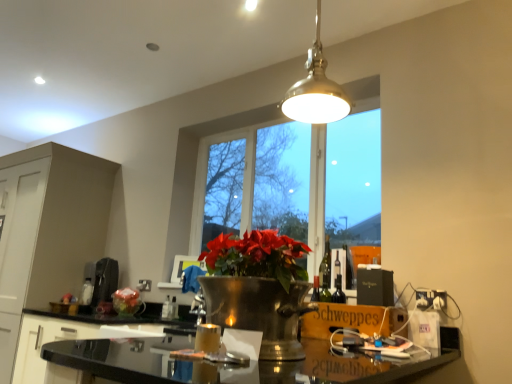
Question: From a real-world perspective, is clear glass window at center located higher than translucent glass bottle at center, which ranks as the 1th bottle in left-to-right order?

Choices:
 (A) no
 (B) yes

Answer: (B)

Question: Is clear glass window at center positioned behind translucent glass bottle at center, which ranks as the 1th bottle in left-to-right order?

Choices:
 (A) yes
 (B) no

Answer: (B)

Question: Considering the relative sizes of clear glass window at center and translucent glass bottle at center, which ranks as the 1th bottle in left-to-right order, in the image provided, is clear glass window at center bigger than translucent glass bottle at center, which ranks as the 1th bottle in left-to-right order,?

Choices:
 (A) yes
 (B) no

Answer: (A)

Question: Does clear glass window at center have a greater width compared to translucent glass bottle at center, positioned as the 2th bottle in right-to-left order?

Choices:
 (A) no
 (B) yes

Answer: (B)

Question: From the image's perspective, is clear glass window at center below translucent glass bottle at center, positioned as the 2th bottle in right-to-left order?

Choices:
 (A) yes
 (B) no

Answer: (B)

Question: In terms of width, does clear glass window at center look wider or thinner when compared to wooden schweppes box at lower right?

Choices:
 (A) thin
 (B) wide

Answer: (A)

Question: Considering the positions of point (x=275, y=122) and point (x=394, y=319), is point (x=275, y=122) closer or farther from the camera than point (x=394, y=319)?

Choices:
 (A) closer
 (B) farther

Answer: (B)

Question: From the image's perspective, relative to wooden schweppes box at lower right, is clear glass window at center above or below?

Choices:
 (A) below
 (B) above

Answer: (B)

Question: In terms of height, does clear glass window at center look taller or shorter compared to wooden schweppes box at lower right?

Choices:
 (A) tall
 (B) short

Answer: (A)

Question: In terms of width, does black glossy countertop at lower center, which ranks as the first cabinetry in right-to-left order, look wider or thinner when compared to wooden schweppes box at lower right?

Choices:
 (A) wide
 (B) thin

Answer: (A)

Question: From the image's perspective, is black glossy countertop at lower center, acting as the second cabinetry starting from the left, above or below wooden schweppes box at lower right?

Choices:
 (A) above
 (B) below

Answer: (B)

Question: Is point (20, 354) closer or farther from the camera than point (306, 326)?

Choices:
 (A) closer
 (B) farther

Answer: (B)

Question: From a real-world perspective, is black glossy countertop at lower center, which ranks as the first cabinetry in right-to-left order, physically located above or below wooden schweppes box at lower right?

Choices:
 (A) below
 (B) above

Answer: (A)

Question: From the image's perspective, is black glossy countertop at center located above or below black glossy countertop at lower center, which ranks as the first cabinetry in right-to-left order?

Choices:
 (A) above
 (B) below

Answer: (A)

Question: Considering the positions of black glossy countertop at center and black glossy countertop at lower center, which ranks as the first cabinetry in right-to-left order, in the image, is black glossy countertop at center bigger or smaller than black glossy countertop at lower center, which ranks as the first cabinetry in right-to-left order,?

Choices:
 (A) big
 (B) small

Answer: (B)